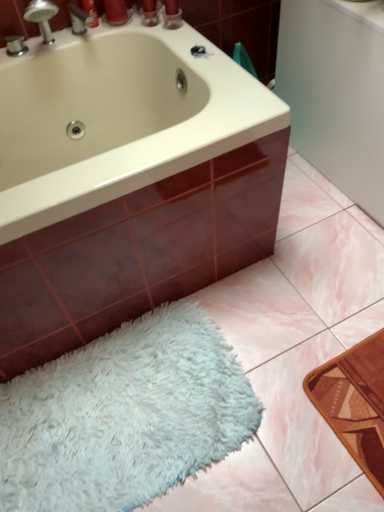
You are a GUI agent. You are given a task and a screenshot of the screen. Output one action in this format:
    pyautogui.click(x=<x>, y=<y>)
    Task: Click on the vacant area located to the right-hand side of brushed metal faucet at upper left
    
    Given the screenshot: What is the action you would take?
    pyautogui.click(x=125, y=36)